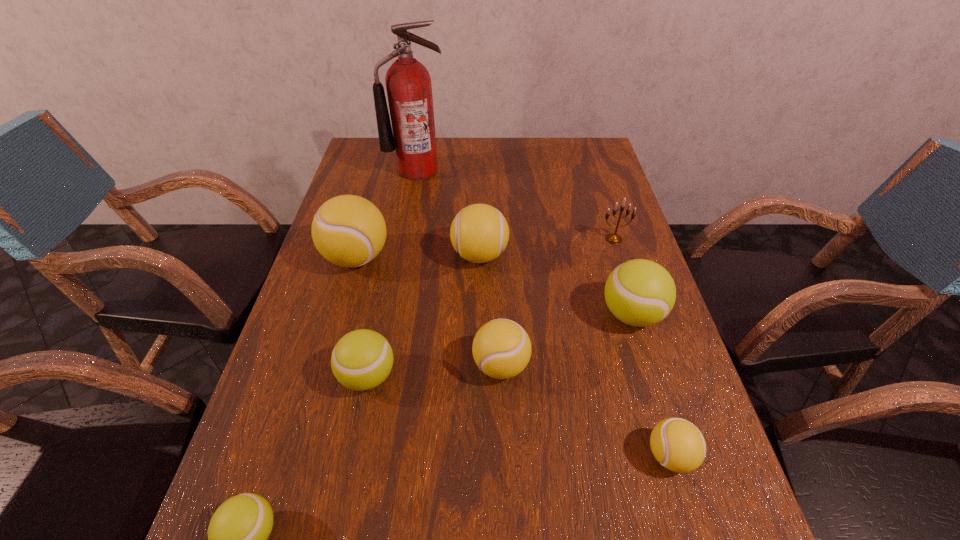
I want to click on the second green tennis ball from left to right, so click(x=362, y=359).

The height and width of the screenshot is (540, 960). I want to click on the smallest yellow tennis ball, so click(677, 444).

This screenshot has width=960, height=540. What are the coordinates of `the nearest yellow tennis ball` in the screenshot? It's located at (677, 444).

The image size is (960, 540). Find the location of `vacant space located 0.260m on the front of the tallest object near the operation label`. vacant space located 0.260m on the front of the tallest object near the operation label is located at coordinates (406, 234).

Locate an element on the screen. This screenshot has height=540, width=960. vacant space located 0.140m on the right of the biggest yellow tennis ball is located at coordinates (444, 258).

What are the coordinates of `free region located on the back of the farthest green tennis ball` in the screenshot? It's located at (610, 244).

Locate an element on the screen. The image size is (960, 540). vacant space positioned on the front of the second biggest yellow tennis ball is located at coordinates (480, 388).

At what (x,y) coordinates should I click in order to perform the action: click on free space located on the back of the candelabrum. Please return your answer as a coordinate pair (x, y). Looking at the image, I should click on (593, 176).

The image size is (960, 540). What are the coordinates of `vacant area situated 0.210m on the right of the third farthest yellow tennis ball` in the screenshot? It's located at (629, 365).

Locate an element on the screen. The height and width of the screenshot is (540, 960). vacant point located on the right of the second biggest green tennis ball is located at coordinates (460, 376).